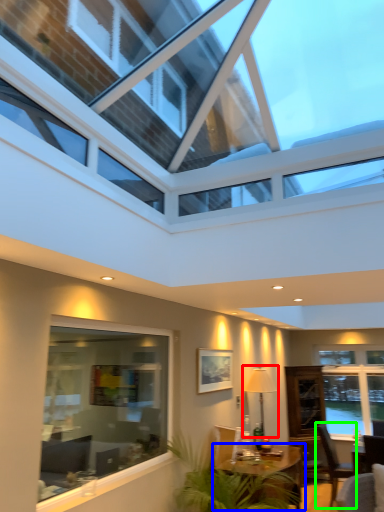
Question: Which object is the farthest from lamp (highlighted by a red box)? Choose among these: table (highlighted by a blue box) or chair (highlighted by a green box).

Choices:
 (A) table
 (B) chair

Answer: (B)